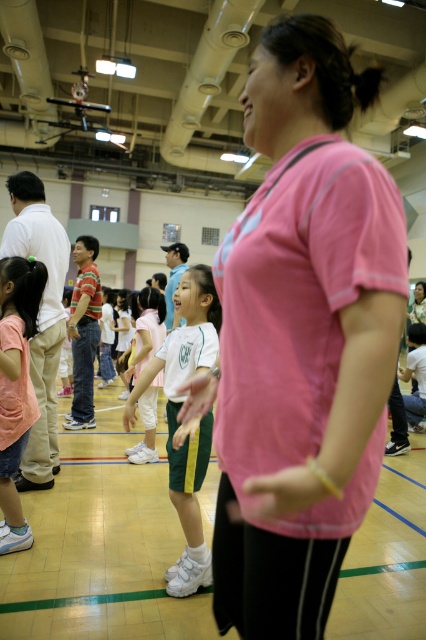
Where is the pink fabric shirt at center located in the image?

The pink fabric shirt at center is located at the point with coordinates 0.530 in the x axis and 0.707 in the y axis.

You are a photographer standing at the back of the gymnasium. You want to take a photo that includes both the pink fabric shirt at center and the white matte uniform at center. What is the minimum distance you need to move forward to ensure both are in frame?

The minimum distance you need to move forward is 1.05 meters to ensure both the pink fabric shirt at center and the white matte uniform at center are in frame.

You are a photographer setting up a shoot in the gymnasium. You need to position a spotlight so it can illuminate both the pink fabric shirt at center and the pink matte shirt at lower left equally. Considering their heights, where should you aim the spotlight?

The pink fabric shirt at center is taller than the pink matte shirt at lower left, so aiming the spotlight slightly higher will ensure both receive equal illumination.